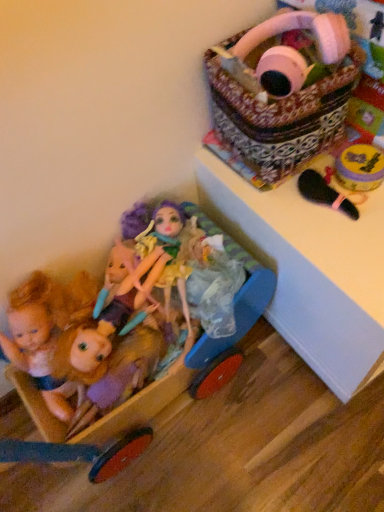
Image resolution: width=384 pixels, height=512 pixels. I want to click on space that is in front of patterned fabric basket at upper right, so click(322, 231).